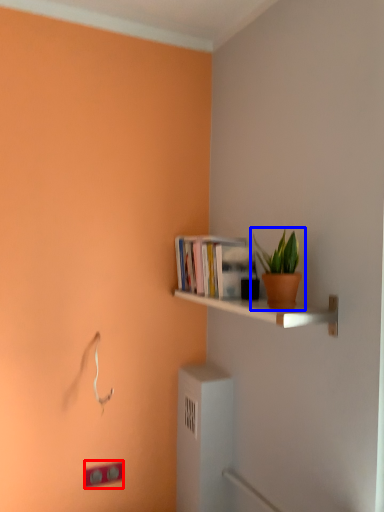
Question: Among these objects, which one is farthest to the camera, light switch (highlighted by a red box) or houseplant (highlighted by a blue box)?

Choices:
 (A) light switch
 (B) houseplant

Answer: (A)